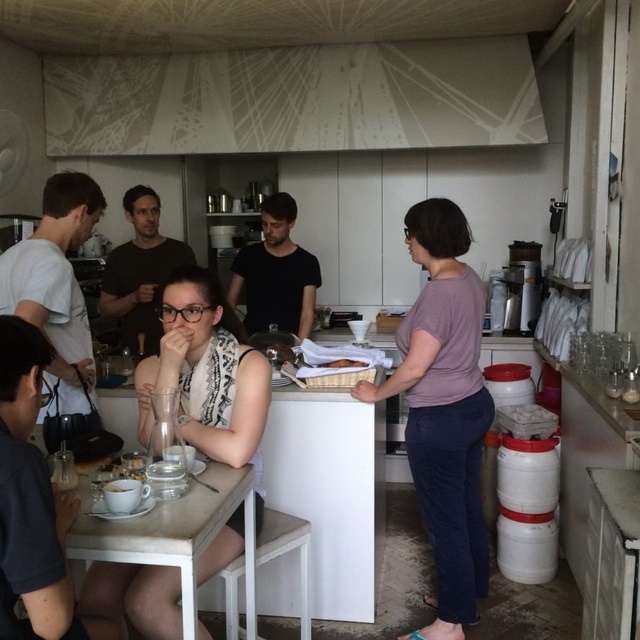
From the picture: You are at a cafe and want to order a drink. You see the purple matte shirt at center and the white wooden table at lower left. Which object is closer to the right side of the image?

The purple matte shirt at center is closer to the right side of the image because it is positioned to the right of the white wooden table at lower left.